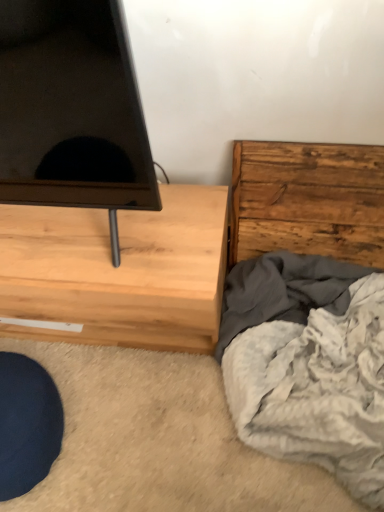
Question: Is rustic wood chest of drawers at right, the 1th chest of drawers viewed from the right, beside soft gray blanket at lower right?

Choices:
 (A) no
 (B) yes

Answer: (A)

Question: From a real-world perspective, is rustic wood chest of drawers at right, the 1th chest of drawers viewed from the right, physically below soft gray blanket at lower right?

Choices:
 (A) yes
 (B) no

Answer: (B)

Question: Does rustic wood chest of drawers at right, which is the 2th chest of drawers in left-to-right order, have a lesser width compared to soft gray blanket at lower right?

Choices:
 (A) yes
 (B) no

Answer: (A)

Question: Does rustic wood chest of drawers at right, which is the 2th chest of drawers in left-to-right order, have a lesser height compared to soft gray blanket at lower right?

Choices:
 (A) yes
 (B) no

Answer: (B)

Question: Is rustic wood chest of drawers at right, the 1th chest of drawers viewed from the right, positioned behind soft gray blanket at lower right?

Choices:
 (A) no
 (B) yes

Answer: (B)

Question: Is soft gray blanket at lower right to the left or to the right of light wood chest of drawers at left, acting as the 1th chest of drawers starting from the left, in the image?

Choices:
 (A) right
 (B) left

Answer: (A)

Question: From the image's perspective, is soft gray blanket at lower right above or below light wood chest of drawers at left, acting as the 1th chest of drawers starting from the left?

Choices:
 (A) below
 (B) above

Answer: (A)

Question: Considering the positions of soft gray blanket at lower right and light wood chest of drawers at left, marked as the 2th chest of drawers in a right-to-left arrangement, in the image, is soft gray blanket at lower right taller or shorter than light wood chest of drawers at left, marked as the 2th chest of drawers in a right-to-left arrangement,?

Choices:
 (A) short
 (B) tall

Answer: (A)

Question: Looking at their shapes, would you say soft gray blanket at lower right is wider or thinner than light wood chest of drawers at left, acting as the 1th chest of drawers starting from the left?

Choices:
 (A) wide
 (B) thin

Answer: (A)

Question: Is rustic wood chest of drawers at right, which is the 2th chest of drawers in left-to-right order, in front of or behind light wood chest of drawers at left, acting as the 1th chest of drawers starting from the left, in the image?

Choices:
 (A) front
 (B) behind

Answer: (B)

Question: From the image's perspective, is rustic wood chest of drawers at right, which is the 2th chest of drawers in left-to-right order, above or below light wood chest of drawers at left, acting as the 1th chest of drawers starting from the left?

Choices:
 (A) below
 (B) above

Answer: (B)

Question: Does point (296, 185) appear closer or farther from the camera than point (152, 342)?

Choices:
 (A) farther
 (B) closer

Answer: (B)

Question: Considering the relative positions of rustic wood chest of drawers at right, which is the 2th chest of drawers in left-to-right order, and light wood chest of drawers at left, marked as the 2th chest of drawers in a right-to-left arrangement, in the image provided, is rustic wood chest of drawers at right, which is the 2th chest of drawers in left-to-right order, to the left or to the right of light wood chest of drawers at left, marked as the 2th chest of drawers in a right-to-left arrangement,?

Choices:
 (A) right
 (B) left

Answer: (A)

Question: In terms of height, does light wood chest of drawers at left, acting as the 1th chest of drawers starting from the left, look taller or shorter compared to rustic wood chest of drawers at right, the 1th chest of drawers viewed from the right?

Choices:
 (A) short
 (B) tall

Answer: (A)

Question: Is light wood chest of drawers at left, acting as the 1th chest of drawers starting from the left, inside or outside of rustic wood chest of drawers at right, the 1th chest of drawers viewed from the right?

Choices:
 (A) outside
 (B) inside

Answer: (A)